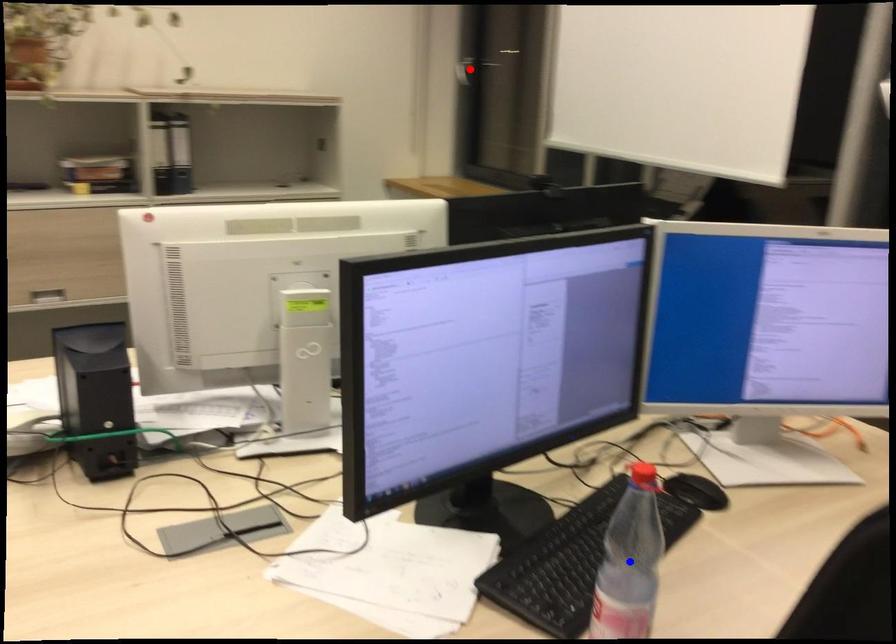
Question: Two points are marked on the image. Which point is closer to the camera?

Choices:
 (A) Blue point is closer.
 (B) Red point is closer.

Answer: (A)